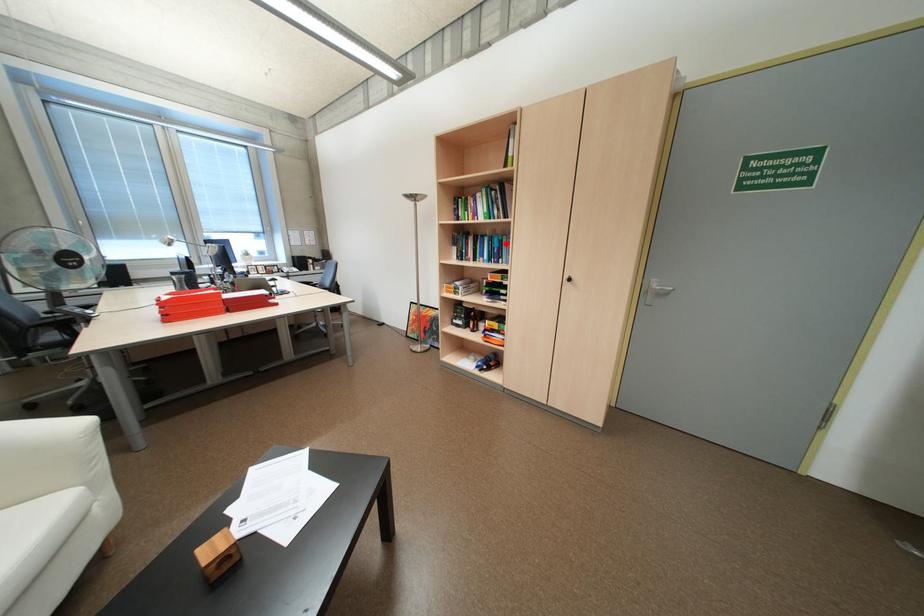
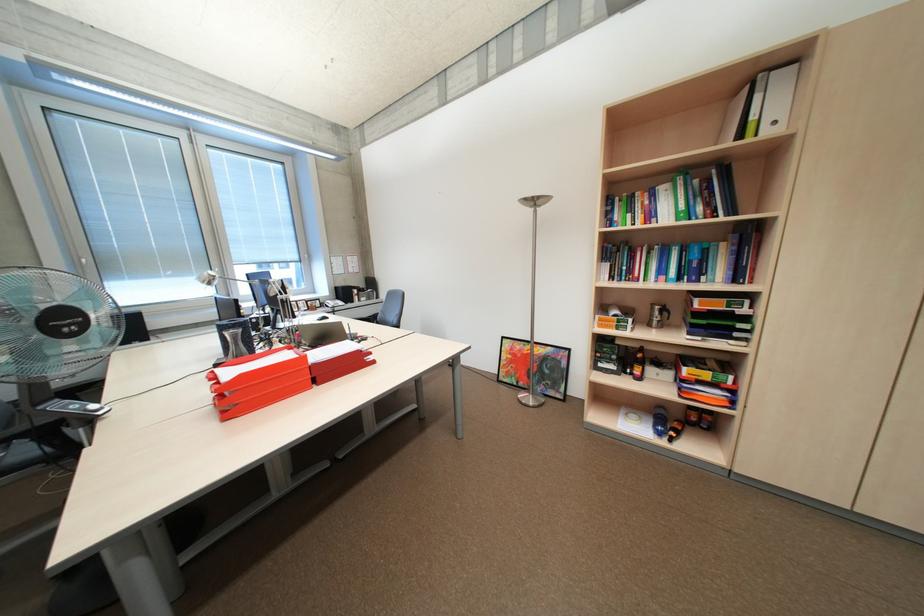
Locate, in the second image, the point that corresponds to the highlighted location in the first image.

(704, 254)